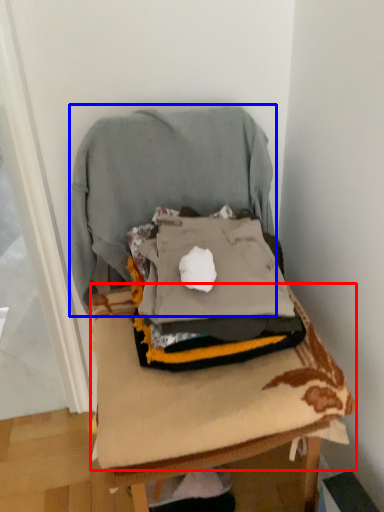
Question: Which of the following is the farthest to the observer, sheet (highlighted by a red box) or sweatshirt (highlighted by a blue box)?

Choices:
 (A) sheet
 (B) sweatshirt

Answer: (B)